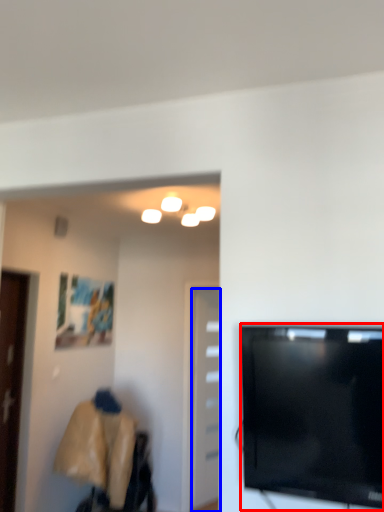
Question: Which object appears closest to the camera in this image, television (highlighted by a red box) or door (highlighted by a blue box)?

Choices:
 (A) television
 (B) door

Answer: (A)